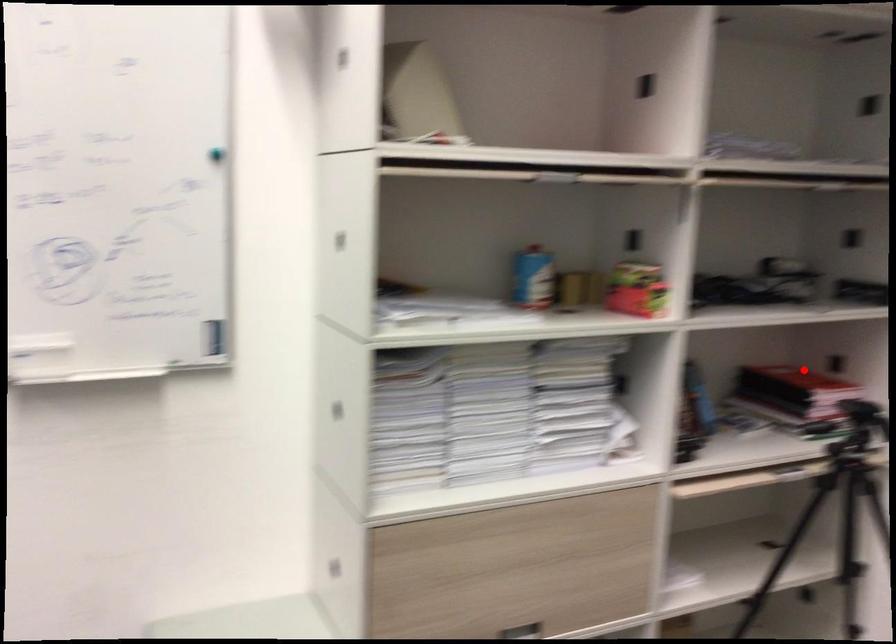
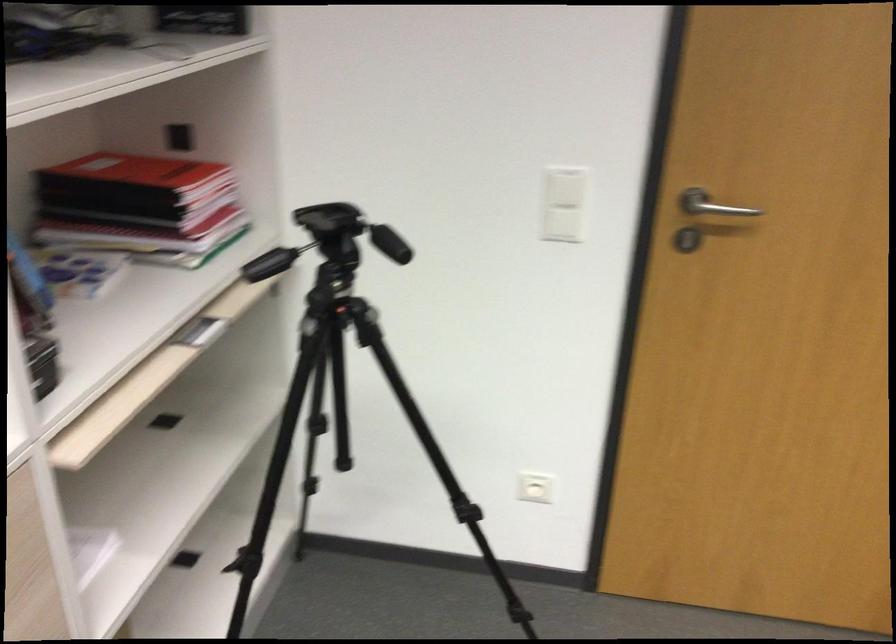
Question: I am providing you with two images of the same scene from different viewpoints. Image1 has a red point marked. In image2, the corresponding 3D location appears at what relative position? Reply with the corresponding letter.

Choices:
 (A) Closer
 (B) Farther

Answer: (A)